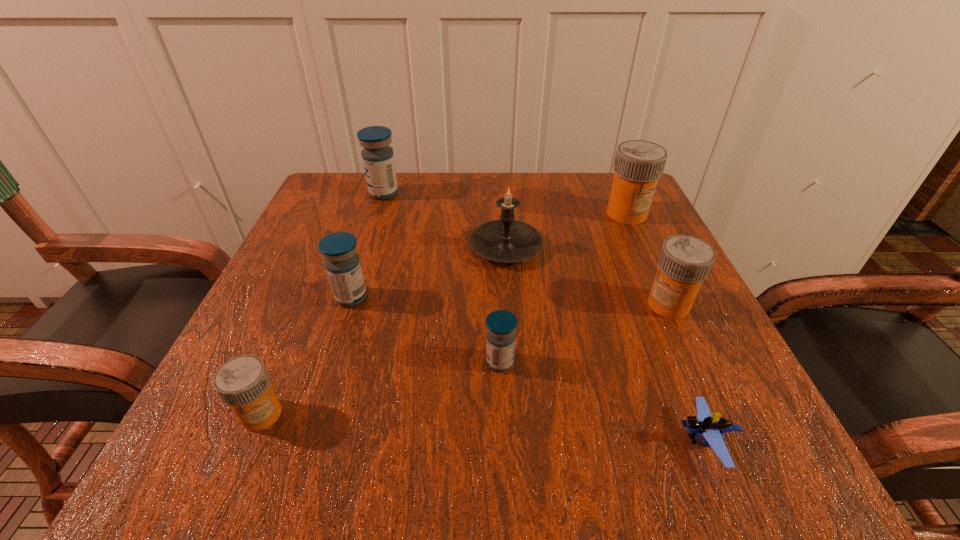
At what (x,y) coordinates should I click in order to perform the action: click on vacant area situated on the back of the sixth farthest object. Please return your answer as a coordinate pair (x, y). Looking at the image, I should click on (497, 306).

You are a GUI agent. You are given a task and a screenshot of the screen. Output one action in this format:
    pyautogui.click(x=<x>, y=<y>)
    Task: Click on the free location located 0.140m on the front-facing side of the shortest object
    The height and width of the screenshot is (540, 960).
    Given the screenshot: What is the action you would take?
    pyautogui.click(x=567, y=441)

The height and width of the screenshot is (540, 960). Identify the location of free space located on the front-facing side of the shortest object. (621, 441).

Where is `vacant space situated 0.120m on the front-facing side of the shortest object`? Image resolution: width=960 pixels, height=540 pixels. vacant space situated 0.120m on the front-facing side of the shortest object is located at coordinates coord(583,441).

Locate an element on the screen. The width and height of the screenshot is (960, 540). candle that is at the far edge is located at coordinates (506, 240).

Identify the location of medicine that is at the near edge. (243, 382).

Where is `Lego situated at the near edge`? Lego situated at the near edge is located at coordinates (711, 428).

Where is `Lego present at the right edge`? The image size is (960, 540). Lego present at the right edge is located at coordinates (711, 428).

Where is `object at the far left corner`? The image size is (960, 540). object at the far left corner is located at coordinates (378, 160).

The image size is (960, 540). Identify the location of object positioned at the near left corner. (243, 382).